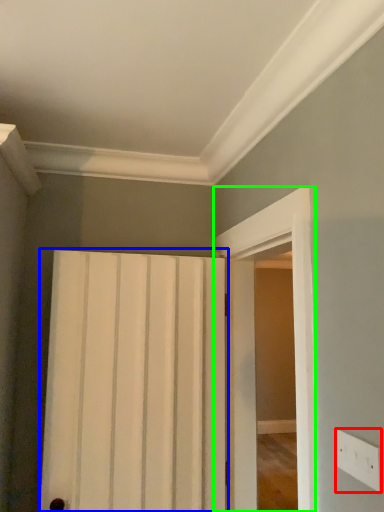
Question: Estimate the real-world distances between objects in this image. Which object is closer to electric outlet (highlighted by a red box), door (highlighted by a blue box) or screen door (highlighted by a green box)?

Choices:
 (A) door
 (B) screen door

Answer: (B)